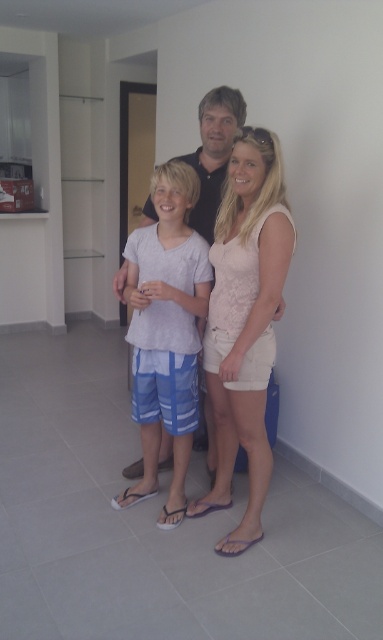
You are a photographer setting up a photo shoot in the described scene. You need to ensure that the pale pink lace top at center and the white cotton shirt at center are both visible in the frame. Given their sizes, which one might require you to adjust your camera angle to capture its details more clearly?

The pale pink lace top at center is smaller than the white cotton shirt at center, so it might require adjusting the camera angle to zoom in or get closer to capture its details more clearly.

You are a delivery person standing at the entrance of the house. You need to deliver a package to the person wearing the pale pink lace top at center. The delivery robot you are using has a maximum delivery range of 6 feet. Can the robot deliver the package to the person?

The pale pink lace top at center and viewer are 6.55 feet apart. Since the delivery robot has a maximum range of 6 feet, it cannot reach the person wearing the pale pink lace top at center as they are 6.55 feet away.